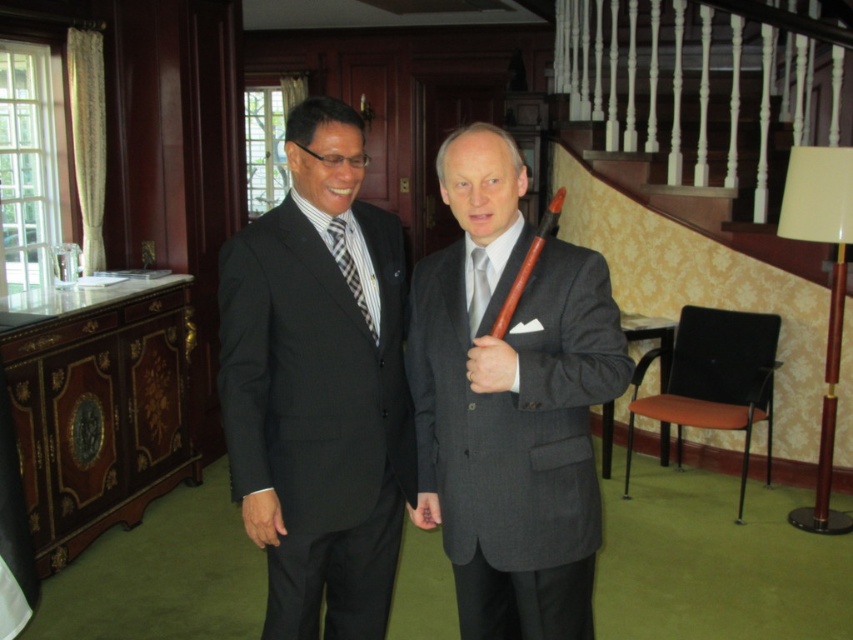
You are a photographer setting up for a formal event. You need to ensure that both the matte black suit at center and the silver silk tie at center are clearly visible in your shot. Given their sizes, which one might require more careful framing to avoid being overshadowed?

The silver silk tie at center is smaller than the matte black suit at center, so it might require more careful framing to ensure it is clearly visible and not overshadowed by the larger matte black suit at center.

You are standing in the room and want to place a small potted plant between the two points, point [509,225] and point [361,310]. Since the plant needs to be placed closer to the one that is nearer to you, which point should you choose?

You should place the plant closer to point [509,225] because it is closer to the viewer than point [361,310].